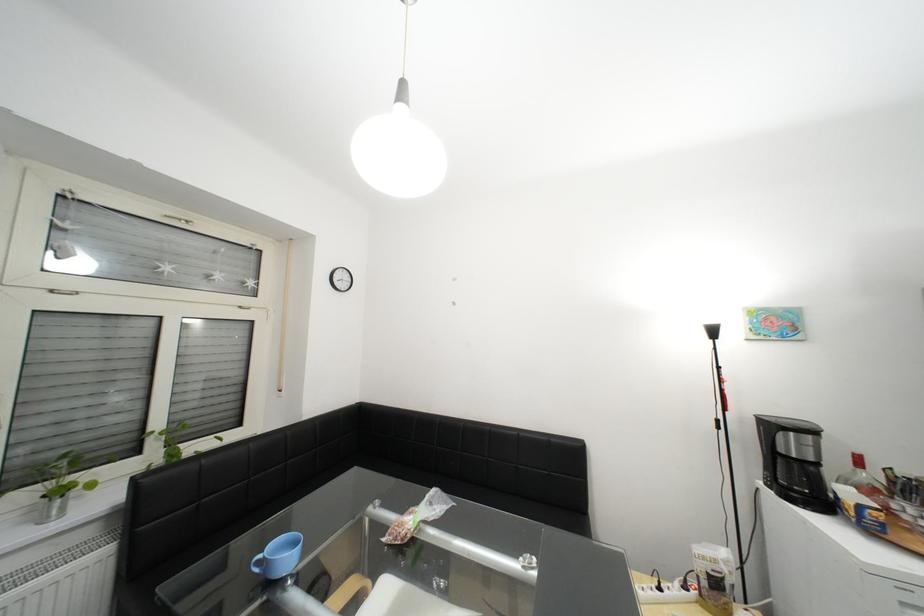
Identify the location of window handle. (178, 217).